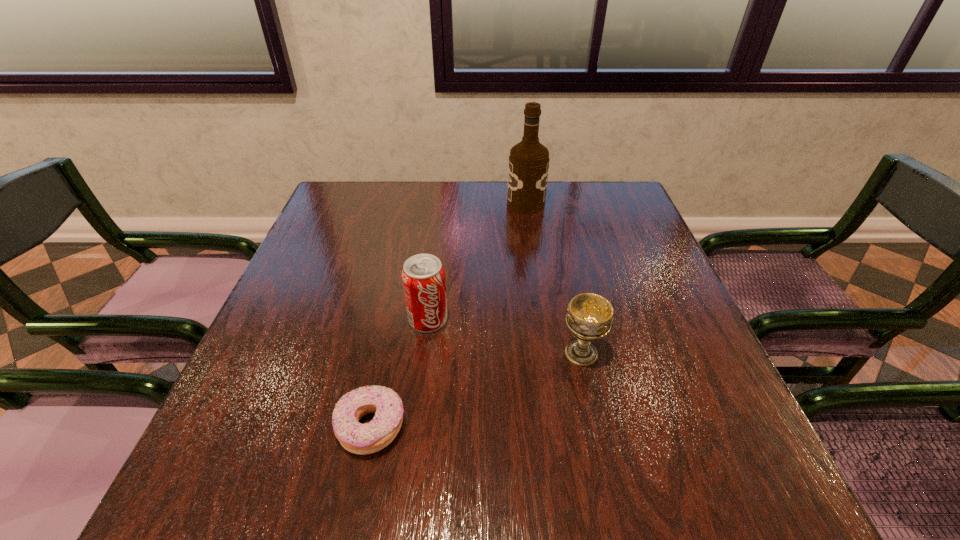
Locate an element on the screen. The height and width of the screenshot is (540, 960). free space that is in between the nearest object and the third shortest object is located at coordinates [x=400, y=374].

Where is `object that stands as the third closest to the doughnut`? This screenshot has height=540, width=960. object that stands as the third closest to the doughnut is located at coordinates (528, 168).

Identify the location of object that stands as the third closest to the chalice. This screenshot has height=540, width=960. click(x=528, y=168).

The height and width of the screenshot is (540, 960). Find the location of `free point that satisfies the following two spatial constraints: 1. on the label of the farthest object; 2. on the left side of the chalice`. free point that satisfies the following two spatial constraints: 1. on the label of the farthest object; 2. on the left side of the chalice is located at coordinates (548, 353).

In order to click on vacant space that satisfies the following two spatial constraints: 1. on the label of the alcohol; 2. on the front side of the soda can in this screenshot , I will do `click(542, 320)`.

Where is `vacant region that satisfies the following two spatial constraints: 1. on the label of the farthest object; 2. on the right side of the third tallest object`? The width and height of the screenshot is (960, 540). vacant region that satisfies the following two spatial constraints: 1. on the label of the farthest object; 2. on the right side of the third tallest object is located at coordinates (548, 353).

Where is `vacant point that satisfies the following two spatial constraints: 1. on the label of the alcohol; 2. on the front side of the third shortest object`? The width and height of the screenshot is (960, 540). vacant point that satisfies the following two spatial constraints: 1. on the label of the alcohol; 2. on the front side of the third shortest object is located at coordinates (542, 320).

The height and width of the screenshot is (540, 960). I want to click on free space that satisfies the following two spatial constraints: 1. on the back side of the shortest object; 2. on the left side of the second farthest object, so click(394, 320).

Where is `vacant space that satisfies the following two spatial constraints: 1. on the label of the tallest object; 2. on the back side of the chalice`? vacant space that satisfies the following two spatial constraints: 1. on the label of the tallest object; 2. on the back side of the chalice is located at coordinates (548, 353).

At what (x,y) coordinates should I click in order to perform the action: click on blank space that satisfies the following two spatial constraints: 1. on the label of the chalice; 2. on the left side of the farthest object. Please return your answer as a coordinate pair (x, y). The image size is (960, 540). Looking at the image, I should click on (548, 353).